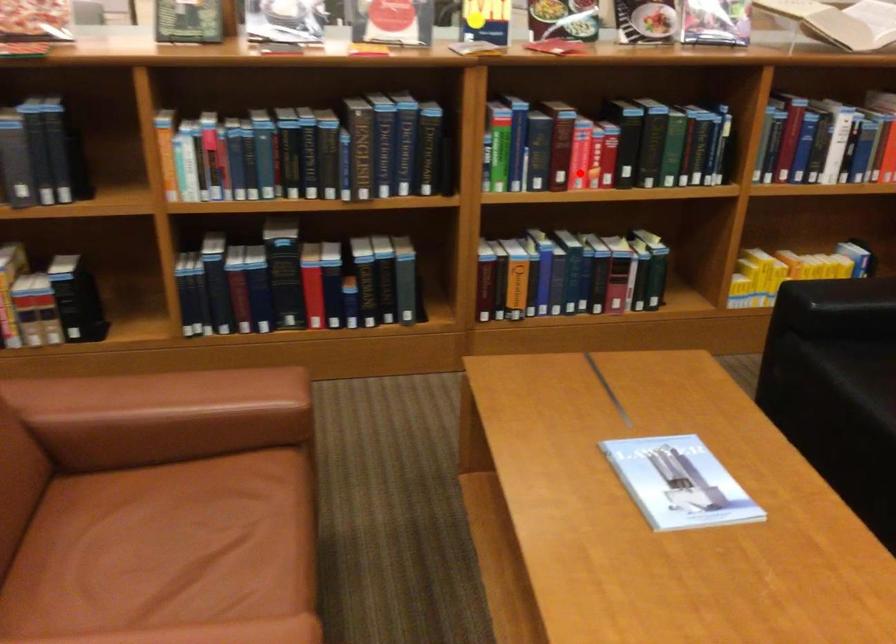
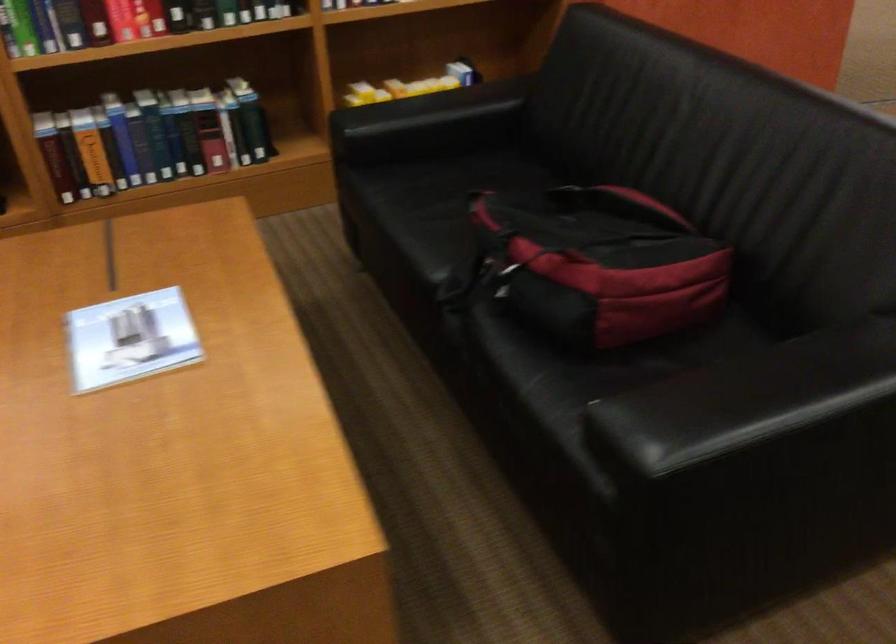
Question: I am providing you with two images of the same scene from different viewpoints. Image1 has a red point marked. In image2, the corresponding 3D location appears at what relative position? Reply with the corresponding letter.

Choices:
 (A) Closer
 (B) Farther

Answer: (A)